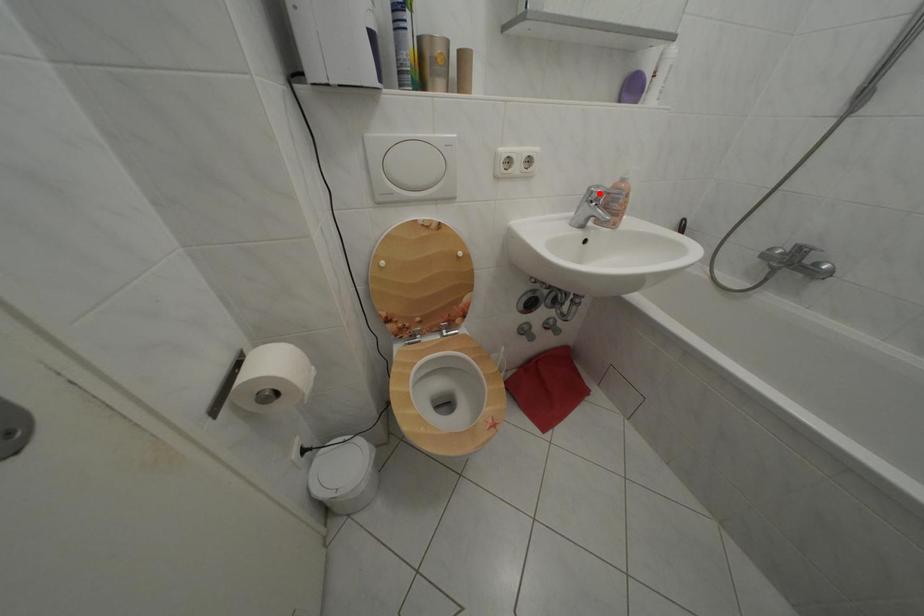
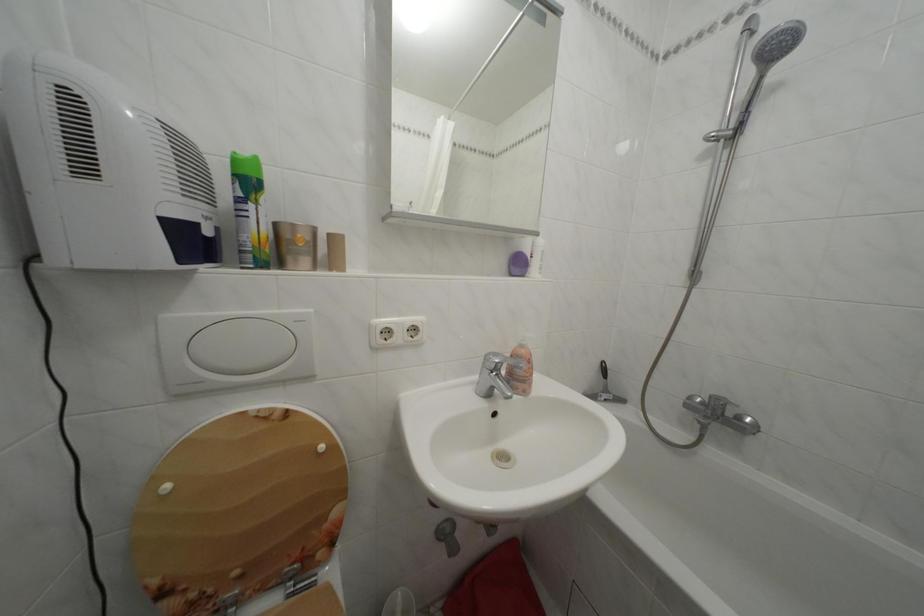
Question: I am providing you with two images of the same scene from different viewpoints. Image1 has a red point marked. In image2, the corresponding 3D location appears at what relative position? Reply with the corresponding letter.

Choices:
 (A) Closer
 (B) Farther

Answer: (B)